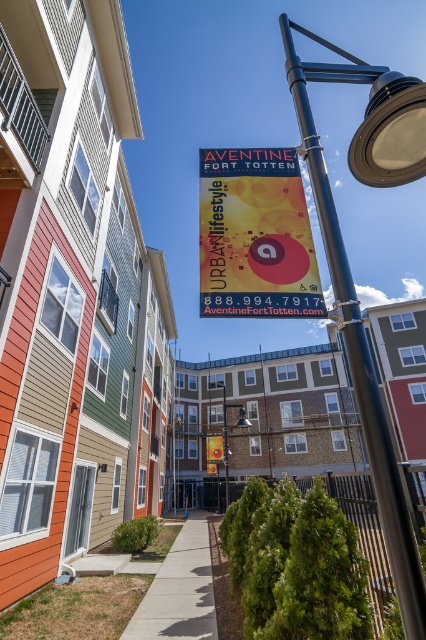
Question: Can you confirm if yellow fabric sign at center is smaller than metallic pole at center?

Choices:
 (A) no
 (B) yes

Answer: (B)

Question: Which object appears farthest from the camera in this image?

Choices:
 (A) gray concrete sidewalk at center
 (B) yellow fabric sign at center
 (C) metallic pole at center
 (D) black metal pole at upper right

Answer: (C)

Question: Which of these objects is positioned closest to the black metal pole at upper right?

Choices:
 (A) gray concrete sidewalk at center
 (B) yellow fabric sign at center
 (C) metallic pole at center

Answer: (B)

Question: Which point is farther to the camera?

Choices:
 (A) (291, 67)
 (B) (140, 630)

Answer: (B)

Question: Can you confirm if yellow fabric sign at center is wider than black metal pole at upper right?

Choices:
 (A) yes
 (B) no

Answer: (A)

Question: Can you confirm if gray concrete sidewalk at center is positioned above metallic pole at center?

Choices:
 (A) no
 (B) yes

Answer: (B)